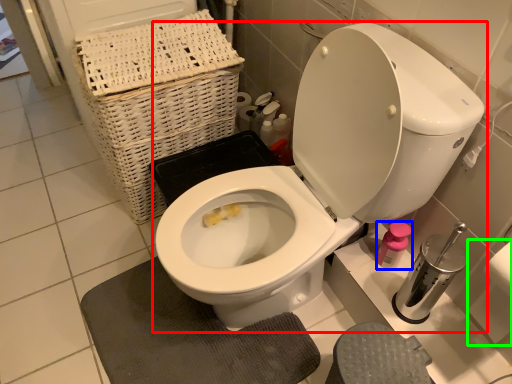
Question: Based on their relative distances, which object is farther from toilet (highlighted by a red box)? Choose from toiletry (highlighted by a blue box) and toilet paper (highlighted by a green box).

Choices:
 (A) toiletry
 (B) toilet paper

Answer: (B)